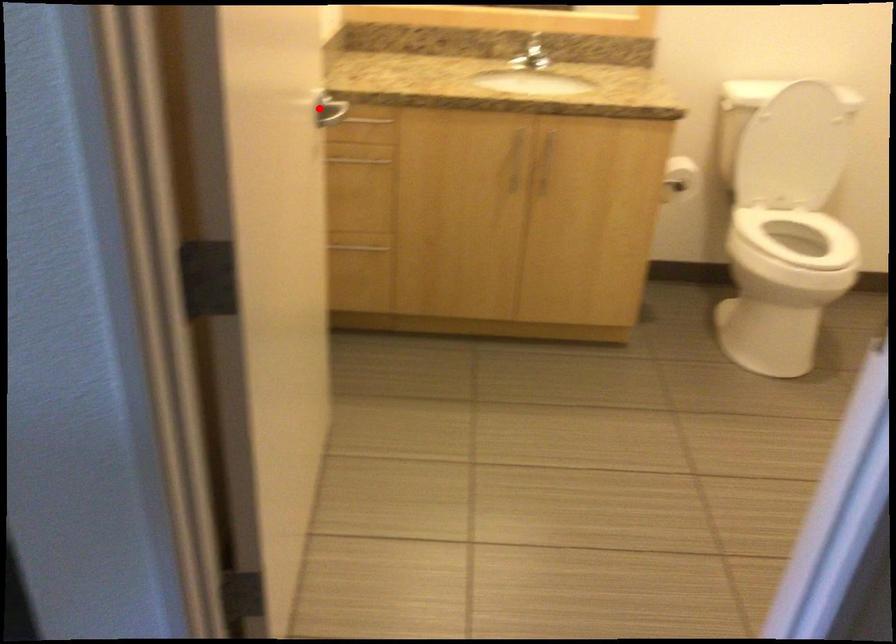
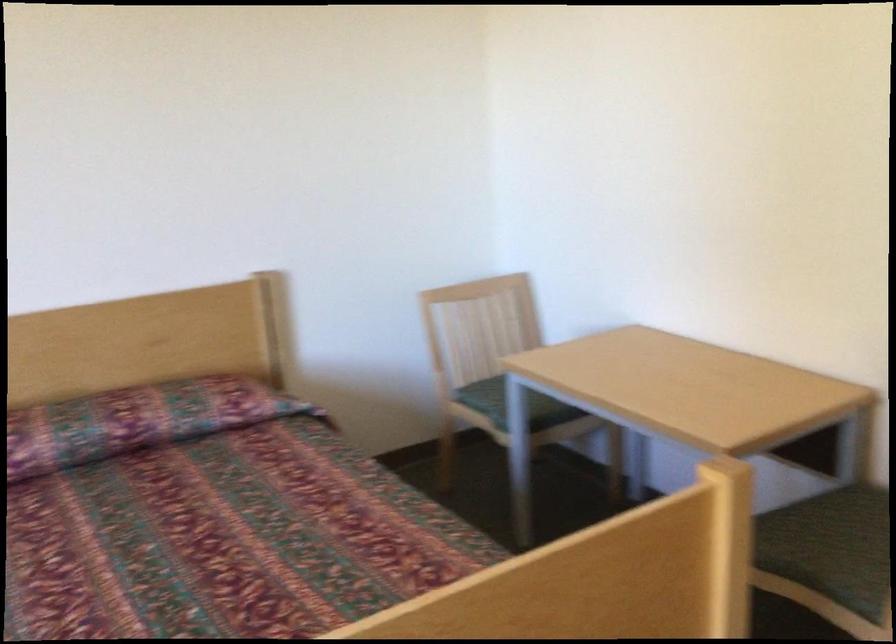
Question: I am providing you with two images of the same scene from different viewpoints. A red point is marked on the first image. Is the red point's position out of view in image 2?

Choices:
 (A) Yes
 (B) No

Answer: (A)